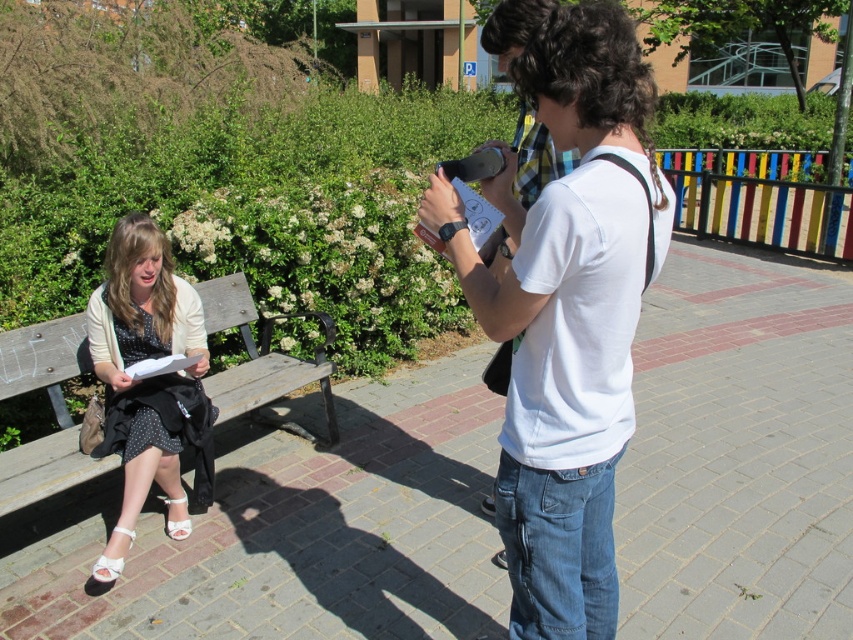
You are trying to determine if the person wearing the white cotton shirt at center can sit on the wooden bench at left without their head touching the bench. Based on the scene, can they?

The white cotton shirt at center is much taller than the wooden bench at left, so their head would likely touch or go beyond the bench if they tried to sit.